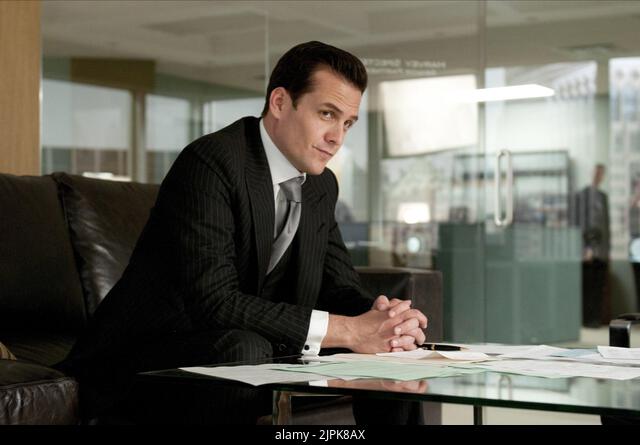
Find the location of `window`. window is located at coordinates (445, 115).